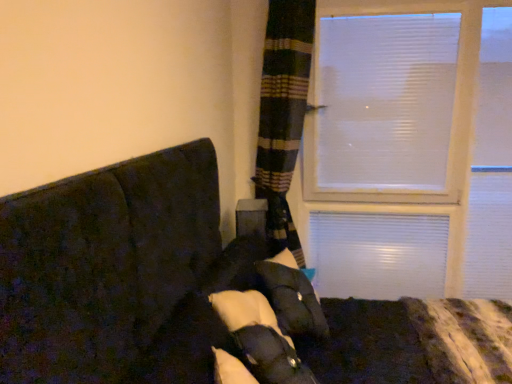
This screenshot has height=384, width=512. What do you see at coordinates (291, 299) in the screenshot?
I see `white soft pillow at center` at bounding box center [291, 299].

You are a GUI agent. You are given a task and a screenshot of the screen. Output one action in this format:
    pyautogui.click(x=<x>, y=<y>)
    Task: Click on the white soft pillow at center
    Image resolution: width=512 pixels, height=384 pixels.
    Given the screenshot: What is the action you would take?
    pyautogui.click(x=291, y=299)

What do you see at coordinates (198, 291) in the screenshot?
I see `dark fabric couch at left` at bounding box center [198, 291].

At what (x,y) coordinates should I click in order to perform the action: click on dark fabric couch at left. Please return your answer as a coordinate pair (x, y). The image size is (512, 384). Looking at the image, I should click on (198, 291).

This screenshot has width=512, height=384. What are the coordinates of `white soft pillow at center` in the screenshot? It's located at (291, 299).

Which is more to the left, dark fabric couch at left or white soft pillow at center?

white soft pillow at center.

Which object is closer to the camera taking this photo, dark fabric couch at left or white soft pillow at center?

Positioned in front is dark fabric couch at left.

Does point (226, 248) come closer to viewer compared to point (270, 266)?

No, (226, 248) is further to viewer.

From the image's perspective, which is above, dark fabric couch at left or white soft pillow at center?

white soft pillow at center is shown above in the image.

From a real-world perspective, which is physically below, dark fabric couch at left or white soft pillow at center?

From a 3D spatial view, dark fabric couch at left is below.

Considering the sizes of dark fabric couch at left and white soft pillow at center in the image, is dark fabric couch at left wider or thinner than white soft pillow at center?

Clearly, dark fabric couch at left has more width compared to white soft pillow at center.

Considering the relative sizes of dark fabric couch at left and white soft pillow at center in the image provided, is dark fabric couch at left taller than white soft pillow at center?

Correct, dark fabric couch at left is much taller as white soft pillow at center.

Is dark fabric couch at left bigger than white soft pillow at center?

Yes, dark fabric couch at left is bigger than white soft pillow at center.

Is dark fabric couch at left outside of white soft pillow at center?

Yes.

Are dark fabric couch at left and white soft pillow at center beside each other?

No, dark fabric couch at left is not in contact with white soft pillow at center.

Could you tell me if dark fabric couch at left is turned towards white soft pillow at center?

No, dark fabric couch at left is not oriented towards white soft pillow at center.

How much distance is there between dark fabric couch at left and white soft pillow at center?

dark fabric couch at left and white soft pillow at center are 9.08 inches apart.

Locate an element on the screen. pillow above the dark fabric couch at left (from a real-world perspective) is located at coordinates (291, 299).

Can you confirm if white soft pillow at center is positioned to the left of dark fabric couch at left?

Correct, you'll find white soft pillow at center to the left of dark fabric couch at left.

Considering the positions of objects white soft pillow at center and dark fabric couch at left in the image provided, who is in front, white soft pillow at center or dark fabric couch at left?

dark fabric couch at left is more forward.

Does point (317, 326) come in front of point (38, 237)?

No, (317, 326) is behind (38, 237).

From the image's perspective, is white soft pillow at center located beneath dark fabric couch at left?

Actually, white soft pillow at center appears above dark fabric couch at left in the image.

From a real-world perspective, between white soft pillow at center and dark fabric couch at left, who is vertically lower?

dark fabric couch at left, from a real-world perspective.

Looking at their sizes, would you say white soft pillow at center is wider or thinner than dark fabric couch at left?

In the image, white soft pillow at center appears to be more narrow than dark fabric couch at left.

In the scene shown: Can you confirm if white soft pillow at center is taller than dark fabric couch at left?

Incorrect, the height of white soft pillow at center is not larger of that of dark fabric couch at left.

Considering the sizes of objects white soft pillow at center and dark fabric couch at left in the image provided, who is bigger, white soft pillow at center or dark fabric couch at left?

dark fabric couch at left is bigger.

Is dark fabric couch at left inside white soft pillow at center?

No, dark fabric couch at left is not inside white soft pillow at center.

In the scene shown: Does white soft pillow at center touch dark fabric couch at left?

There is a gap between white soft pillow at center and dark fabric couch at left.

In the scene shown: Is white soft pillow at center oriented away from dark fabric couch at left?

Yes, white soft pillow at center's orientation is away from dark fabric couch at left.

How different are the orientations of white soft pillow at center and dark fabric couch at left in degrees?

The angular difference between white soft pillow at center and dark fabric couch at left is 19.2 degrees.

The image size is (512, 384). What are the coordinates of `pillow above the dark fabric couch at left (from a real-world perspective)` in the screenshot? It's located at (291, 299).

In order to click on pillow that is on the left side of dark fabric couch at left in this screenshot , I will do `click(291, 299)`.

The width and height of the screenshot is (512, 384). In order to click on furniture that appears below the white soft pillow at center (from the image's perspective) in this screenshot , I will do `click(198, 291)`.